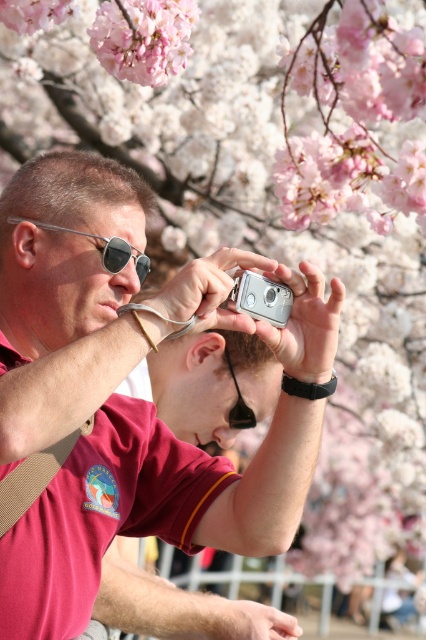
You are a photographer trying to capture the pink matte flower at upper left and the silver metallic camera at center in the same frame. Based on their positions, will the flower appear above the camera in the photo?

Yes, the pink matte flower at upper left is above the silver metallic camera at center, so it will appear above the camera in the photo.

You are a photographer trying to decide which camera to use for capturing the cherry blossoms. Both the matte black camera at center and the silver metallic camera at center are available. Which camera is positioned closer to you?

The matte black camera at center is closer to the viewer than the silver metallic camera at center, so you should choose the matte black camera at center as it is nearer to you.

You are a photographer trying to decide which camera to use for capturing cherry blossoms. You see a matte black camera at center and a silver metallic camera at center. Which camera is located to the left?

The matte black camera at center is positioned on the left side of the silver metallic camera at center, so the matte black camera at center is the one on the left.